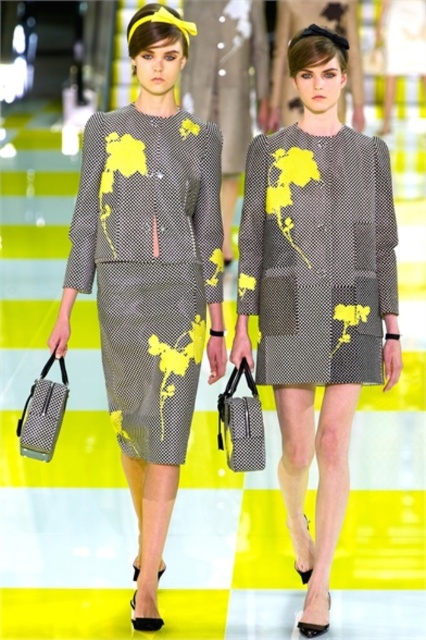
Can you confirm if matte gray dress with yellow floral print at center is positioned to the right of textured gray dress at center?

Incorrect, matte gray dress with yellow floral print at center is not on the right side of textured gray dress at center.

Is point (158, 228) behind point (331, 304)?

Yes, it is behind point (331, 304).

You are a GUI agent. You are given a task and a screenshot of the screen. Output one action in this format:
    pyautogui.click(x=<x>, y=<y>)
    Task: Click on the matte gray dress with yellow floral print at center
    
    Given the screenshot: What is the action you would take?
    149,268

From the picture: Can you confirm if matte gray dress at center is bigger than matte gray dress with yellow floral print at center?

Yes.

This screenshot has height=640, width=426. Describe the element at coordinates (317, 292) in the screenshot. I see `matte gray dress at center` at that location.

Which is in front, point (348, 218) or point (181, 170)?

Point (348, 218)

Locate an element on the screen. matte gray dress at center is located at coordinates (317, 292).

Based on the photo, is matte gray dress at center smaller than textured gray dress at center?

Incorrect, matte gray dress at center is not smaller in size than textured gray dress at center.

Who is more distant from viewer, [305,68] or [321,326]?

The point [321,326] is behind.

Image resolution: width=426 pixels, height=640 pixels. What are the coordinates of `matte gray dress at center` in the screenshot? It's located at (317, 292).